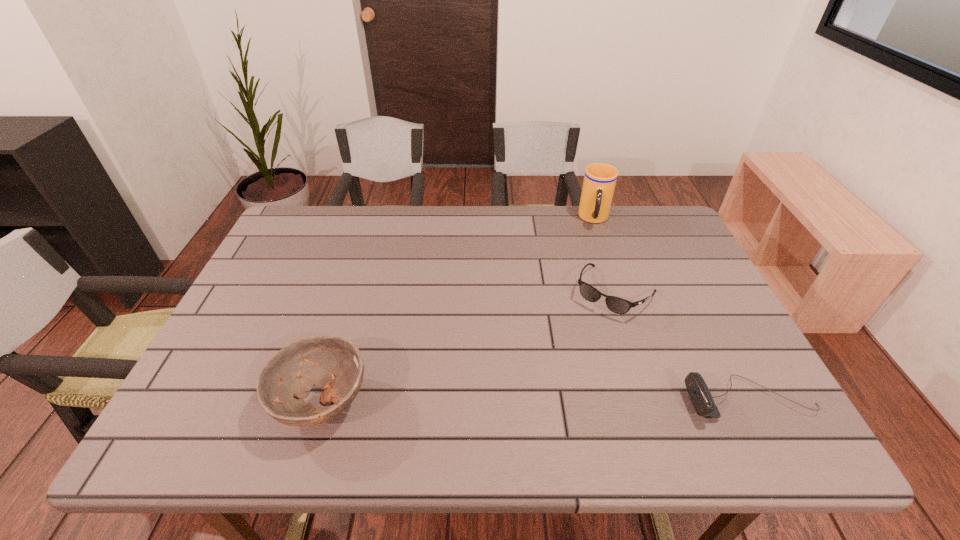
Image resolution: width=960 pixels, height=540 pixels. Identify the location of bowl. (332, 362).

In order to click on the leftmost object in this screenshot , I will do `click(332, 362)`.

Locate an element on the screen. Image resolution: width=960 pixels, height=540 pixels. webcam is located at coordinates (698, 391).

You are a GUI agent. You are given a task and a screenshot of the screen. Output one action in this format:
    pyautogui.click(x=<x>, y=<y>)
    Task: Click on the farthest object
    Image resolution: width=960 pixels, height=540 pixels.
    Given the screenshot: What is the action you would take?
    600,179

Where is `the tallest object`? This screenshot has width=960, height=540. the tallest object is located at coordinates (600, 179).

The height and width of the screenshot is (540, 960). In order to click on sunglasses in this screenshot , I will do `click(615, 304)`.

Image resolution: width=960 pixels, height=540 pixels. Find the location of `vacant area located 0.400m on the back of the leftmost object`. vacant area located 0.400m on the back of the leftmost object is located at coordinates (367, 253).

At what (x,y) coordinates should I click in order to perform the action: click on vacant space situated 0.090m on the front-facing side of the webcam. Please return your answer as a coordinate pair (x, y). Looking at the image, I should click on (642, 400).

Find the location of a particular element. This screenshot has width=960, height=540. vacant space located on the front-facing side of the webcam is located at coordinates (525, 400).

Where is `vacant space located 0.250m on the front-facing side of the webcam`? vacant space located 0.250m on the front-facing side of the webcam is located at coordinates (567, 400).